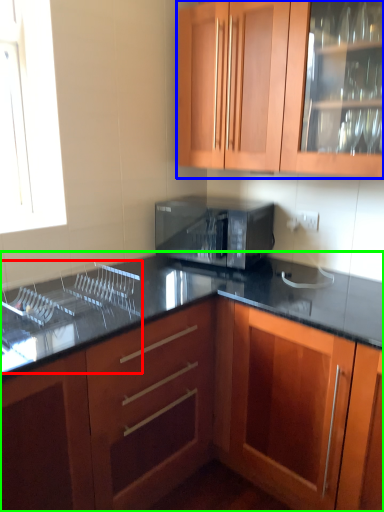
Question: Which object is the closest to the sink (highlighted by a red box)? Choose among these: cabinetry (highlighted by a blue box) or cabinetry (highlighted by a green box).

Choices:
 (A) cabinetry
 (B) cabinetry

Answer: (B)